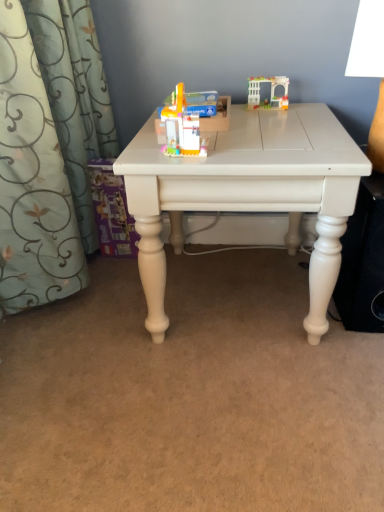
The width and height of the screenshot is (384, 512). I want to click on white matte table at center, so click(248, 192).

This screenshot has width=384, height=512. In order to click on translucent plastic archway at upper right, the 1th toy from the back in this screenshot , I will do `click(271, 91)`.

Describe the element at coordinates (370, 68) in the screenshot. I see `white plastic lampshade at upper right` at that location.

Locate an element on the screen. The height and width of the screenshot is (512, 384). white matte table at center is located at coordinates (248, 192).

Is point (244, 116) positioned behind point (362, 311)?

Yes, point (244, 116) is behind point (362, 311).

There is a white matte speaker at lower right. In order to click on table above it (from a real-world perspective) in this screenshot , I will do `click(248, 192)`.

Is the surface of white matte table at center in direct contact with white matte speaker at lower right?

No, white matte table at center is not in contact with white matte speaker at lower right.

Could you tell me if white matte table at center is turned towards translucent plastic toy at center, placed as the 1th toy when sorted from front to back?

No, white matte table at center is not facing towards translucent plastic toy at center, placed as the 1th toy when sorted from front to back.

Considering the relative sizes of white matte table at center and translucent plastic toy at center, marked as the first toy in a left-to-right arrangement, in the image provided, is white matte table at center shorter than translucent plastic toy at center, marked as the first toy in a left-to-right arrangement,?

In fact, white matte table at center may be taller than translucent plastic toy at center, marked as the first toy in a left-to-right arrangement.

Considering the sizes of objects white matte table at center and translucent plastic toy at center, marked as the first toy in a left-to-right arrangement, in the image provided, who is thinner, white matte table at center or translucent plastic toy at center, marked as the first toy in a left-to-right arrangement,?

translucent plastic toy at center, marked as the first toy in a left-to-right arrangement, is thinner.

From the white matte table at center, count 1st toys backward and point to it. Please provide its 2D coordinates.

[(193, 118)]

Does white plastic lampshade at upper right lie behind white matte speaker at lower right?

No, white plastic lampshade at upper right is closer to the camera.

Consider the image. Is white plastic lampshade at upper right with white matte speaker at lower right?

No, white plastic lampshade at upper right is not with white matte speaker at lower right.

Can you tell me how much white plastic lampshade at upper right and white matte speaker at lower right differ in facing direction?

The angular difference between white plastic lampshade at upper right and white matte speaker at lower right is 4.4 degrees.

Is point (380, 22) farther from viewer compared to point (372, 285)?

That is False.

Does translucent plastic toy at center, placed as the 1th toy when sorted from front to back, have a greater width compared to white plastic lampshade at upper right?

Incorrect, the width of translucent plastic toy at center, placed as the 1th toy when sorted from front to back, does not surpass that of white plastic lampshade at upper right.

Would you say translucent plastic toy at center, marked as the first toy in a left-to-right arrangement, contains white plastic lampshade at upper right?

No.

From the image's perspective, is translucent plastic toy at center, marked as the 2th toy in a right-to-left arrangement, positioned above or below white plastic lampshade at upper right?

translucent plastic toy at center, marked as the 2th toy in a right-to-left arrangement, is below white plastic lampshade at upper right.

Is translucent plastic toy at center, marked as the 2th toy in a right-to-left arrangement, far away from white plastic lampshade at upper right?

No.

Looking at this image, can you tell me how much translucent plastic archway at upper right, which is the 2th toy in front-to-back order, and translucent plastic toy at center, which appears as the 1th toy when ordered from the bottom, differ in facing direction?

1.15 degrees.

Is translucent plastic archway at upper right, which is the 1th toy from top to bottom, situated inside translucent plastic toy at center, which is the second toy from back to front, or outside?

translucent plastic archway at upper right, which is the 1th toy from top to bottom, exists outside the volume of translucent plastic toy at center, which is the second toy from back to front.

Who is smaller, translucent plastic archway at upper right, arranged as the second toy when viewed from the left, or translucent plastic toy at center, placed as the 1th toy when sorted from front to back?

With smaller size is translucent plastic archway at upper right, arranged as the second toy when viewed from the left.

Who is bigger, white plastic lampshade at upper right or white matte table at center?

With larger size is white matte table at center.

How distant is white plastic lampshade at upper right from white matte table at center?

A distance of 11.77 inches exists between white plastic lampshade at upper right and white matte table at center.

Is white matte table at center completely or partially inside white plastic lampshade at upper right?

That's incorrect, white matte table at center is not inside white plastic lampshade at upper right.

From the picture: From the image's perspective, between white plastic lampshade at upper right and white matte table at center, who is located below?

white matte table at center appears lower in the image.

The image size is (384, 512). I want to click on speaker that is under the translucent plastic archway at upper right, arranged as the second toy when viewed from the left (from a real-world perspective), so click(363, 261).

In terms of width, does translucent plastic archway at upper right, marked as the 1th toy in a right-to-left arrangement, look wider or thinner when compared to white matte speaker at lower right?

translucent plastic archway at upper right, marked as the 1th toy in a right-to-left arrangement, is thinner than white matte speaker at lower right.

From the image's perspective, which is above, translucent plastic archway at upper right, which is the 2th toy in front-to-back order, or white matte speaker at lower right?

translucent plastic archway at upper right, which is the 2th toy in front-to-back order, appears higher in the image.

Would you consider translucent plastic archway at upper right, marked as the 1th toy in a right-to-left arrangement, to be distant from white matte speaker at lower right?

translucent plastic archway at upper right, marked as the 1th toy in a right-to-left arrangement, is actually quite close to white matte speaker at lower right.

Find the location of a particular element. The height and width of the screenshot is (512, 384). table on the left of white matte speaker at lower right is located at coordinates (248, 192).

In order to click on toy that is the 1st one when counting upward from the white matte table at center (from the image's perspective) in this screenshot , I will do `click(193, 118)`.

From the image, which object appears to be nearer to white matte speaker at lower right, translucent plastic toy at center, marked as the 2th toy in a right-to-left arrangement, or white plastic lampshade at upper right?

The object closer to white matte speaker at lower right is white plastic lampshade at upper right.

When comparing their distances from translucent plastic toy at center, marked as the 2th toy in a right-to-left arrangement, does white matte speaker at lower right or white plastic lampshade at upper right seem further?

white matte speaker at lower right is further to translucent plastic toy at center, marked as the 2th toy in a right-to-left arrangement.

Considering their positions, is white matte table at center positioned further to white matte speaker at lower right than translucent plastic toy at center, marked as the first toy in a left-to-right arrangement?

translucent plastic toy at center, marked as the first toy in a left-to-right arrangement.

Looking at the image, which one is located closer to white plastic lampshade at upper right, translucent plastic toy at center, marked as the 2th toy in a right-to-left arrangement, or translucent plastic archway at upper right, which is the 2th toy in front-to-back order?

Based on the image, translucent plastic archway at upper right, which is the 2th toy in front-to-back order, appears to be nearer to white plastic lampshade at upper right.

Considering their positions, is white matte table at center positioned closer to translucent plastic archway at upper right, which is the 1th toy from top to bottom, than white plastic lampshade at upper right?

white plastic lampshade at upper right is positioned closer to the anchor translucent plastic archway at upper right, which is the 1th toy from top to bottom.

When comparing their distances from white plastic lampshade at upper right, does white matte speaker at lower right or translucent plastic archway at upper right, arranged as the second toy when viewed from the left, seem closer?

Based on the image, white matte speaker at lower right appears to be nearer to white plastic lampshade at upper right.

Considering their positions, is translucent plastic archway at upper right, which is the 2th toy in front-to-back order, positioned closer to white matte table at center than white plastic lampshade at upper right?

white plastic lampshade at upper right is closer to white matte table at center.

Based on their spatial positions, is white plastic lampshade at upper right or white matte speaker at lower right closer to translucent plastic toy at center, marked as the 2th toy in a right-to-left arrangement?

Among the two, white plastic lampshade at upper right is located nearer to translucent plastic toy at center, marked as the 2th toy in a right-to-left arrangement.

Image resolution: width=384 pixels, height=512 pixels. Identify the location of table lamp between white matte table at center and white matte speaker at lower right in the horizontal direction. pyautogui.click(x=370, y=68).

You are a GUI agent. You are given a task and a screenshot of the screen. Output one action in this format:
    pyautogui.click(x=<x>, y=<y>)
    Task: Click on the table lamp between translucent plastic archway at upper right, the 1th toy from the back, and white matte speaker at lower right from top to bottom
    Image resolution: width=384 pixels, height=512 pixels.
    Given the screenshot: What is the action you would take?
    pyautogui.click(x=370, y=68)

Where is `table lamp situated between translucent plastic toy at center, marked as the 2th toy in a right-to-left arrangement, and white matte speaker at lower right from left to right`? The height and width of the screenshot is (512, 384). table lamp situated between translucent plastic toy at center, marked as the 2th toy in a right-to-left arrangement, and white matte speaker at lower right from left to right is located at coordinates (370, 68).

Locate an element on the screen. toy between translucent plastic toy at center, marked as the 2th toy in a right-to-left arrangement, and white matte speaker at lower right, in the horizontal direction is located at coordinates (271, 91).